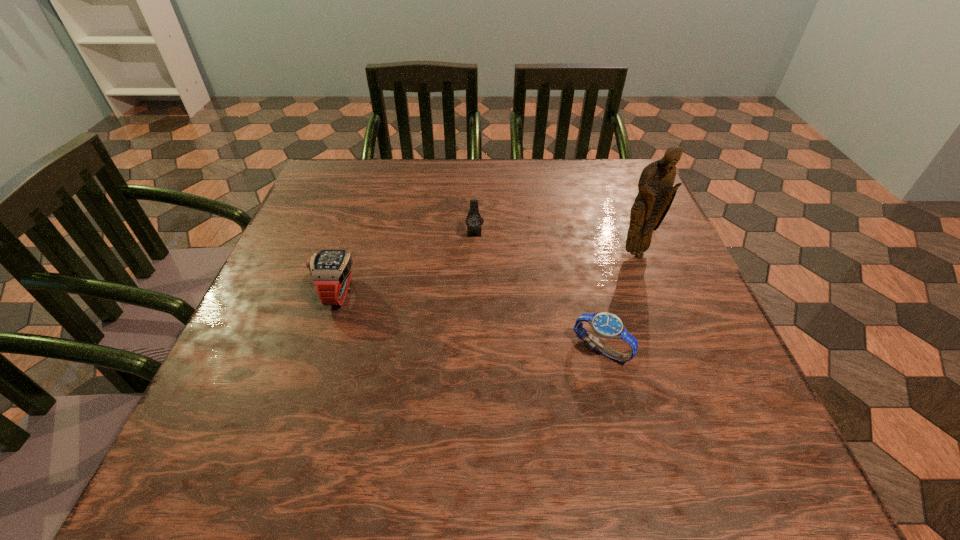
Where is `empty location between the leftmost watch and the second object from right to left`? This screenshot has height=540, width=960. empty location between the leftmost watch and the second object from right to left is located at coordinates (469, 321).

This screenshot has height=540, width=960. I want to click on empty space between the farthest object and the second nearest watch, so pos(406,262).

Locate which object is the closest to the shortest object. Please provide its 2D coordinates. Your answer should be formatted as a tuple, i.e. [(x, y)], where the tuple contains the x and y coordinates of a point satisfying the conditions above.

[(656, 193)]

Locate an element on the screen. Image resolution: width=960 pixels, height=540 pixels. object that is the closest to the shortest watch is located at coordinates (656, 193).

I want to click on watch that is the third closest to the tallest object, so click(331, 269).

Identify which watch is the second nearest to the nearest object. Please provide its 2D coordinates. Your answer should be formatted as a tuple, i.e. [(x, y)], where the tuple contains the x and y coordinates of a point satisfying the conditions above.

[(331, 269)]

I want to click on vacant space that satisfies the following two spatial constraints: 1. on the face of the third object from left to right; 2. on the left side of the second watch from right to left, so click(x=473, y=349).